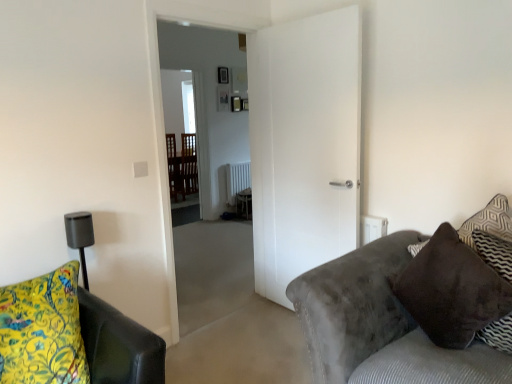
Identify the location of yellow floral fabric cushion at lower left. [x=72, y=336].

Describe the element at coordinates (424, 289) in the screenshot. I see `brown suede pillow at right` at that location.

Where is `white matte door at center`? This screenshot has width=512, height=384. white matte door at center is located at coordinates (304, 145).

Between white matte door at center and transparent glass door at center, which one appears on the right side from the viewer's perspective?

From the viewer's perspective, white matte door at center appears more on the right side.

From the image's perspective, would you say white matte door at center is positioned over transparent glass door at center?

No, from the image's perspective, white matte door at center is not over transparent glass door at center.

Considering the relative sizes of white matte door at center and transparent glass door at center in the image provided, is white matte door at center wider than transparent glass door at center?

Incorrect, the width of white matte door at center does not surpass that of transparent glass door at center.

Which is in front, white matte door at center or transparent glass door at center?

white matte door at center is more forward.

Where is `radiator behind the white matte door at center`? The image size is (512, 384). radiator behind the white matte door at center is located at coordinates (237, 180).

Measure the distance from white matte door at center to white painted radiator at center.

white matte door at center and white painted radiator at center are 14.28 feet apart from each other.

Considering the sizes of objects white matte door at center and white painted radiator at center in the image provided, who is smaller, white matte door at center or white painted radiator at center?

white painted radiator at center is smaller.

Between white painted radiator at center and white matte door at center, which one has larger width?

white painted radiator at center is wider.

Image resolution: width=512 pixels, height=384 pixels. In order to click on door on the right of the white painted radiator at center in this screenshot , I will do `click(304, 145)`.

Considering the positions of objects white painted radiator at center and white matte door at center in the image provided, who is more to the left, white painted radiator at center or white matte door at center?

Positioned to the left is white painted radiator at center.

From the image's perspective, which is below, white painted radiator at center or white matte door at center?

white matte door at center, from the image's perspective.

Can you confirm if white painted radiator at center is taller than brown suede pillow at right?

No, white painted radiator at center is not taller than brown suede pillow at right.

Is white painted radiator at center not close to brown suede pillow at right?

Yes, white painted radiator at center and brown suede pillow at right are quite far apart.

From the image's perspective, would you say white painted radiator at center is positioned over brown suede pillow at right?

Correct, white painted radiator at center appears higher than brown suede pillow at right in the image.

Which is in front, point (234, 193) or point (437, 250)?

Point (437, 250)

From the image's perspective, is yellow floral fabric cushion at lower left positioned above or below transparent glass door at center?

yellow floral fabric cushion at lower left is below transparent glass door at center.

Is yellow floral fabric cushion at lower left facing away from transparent glass door at center?

yellow floral fabric cushion at lower left is not turned away from transparent glass door at center.

From a real-world perspective, is yellow floral fabric cushion at lower left physically located above or below transparent glass door at center?

yellow floral fabric cushion at lower left is situated lower than transparent glass door at center in the real world.

Which is in front, white painted radiator at center or yellow floral fabric cushion at lower left?

yellow floral fabric cushion at lower left is closer to the camera.

From a real-world perspective, is white painted radiator at center positioned above or below yellow floral fabric cushion at lower left?

white painted radiator at center is situated lower than yellow floral fabric cushion at lower left in the real world.

Considering the relative positions of white painted radiator at center and yellow floral fabric cushion at lower left in the image provided, is white painted radiator at center to the right of yellow floral fabric cushion at lower left from the viewer's perspective?

Correct, you'll find white painted radiator at center to the right of yellow floral fabric cushion at lower left.

Is white painted radiator at center with yellow floral fabric cushion at lower left?

There is a gap between white painted radiator at center and yellow floral fabric cushion at lower left.

Do you think brown suede pillow at right is within white painted radiator at center, or outside of it?

brown suede pillow at right is spatially situated outside white painted radiator at center.

Is brown suede pillow at right positioned with its back to white painted radiator at center?

brown suede pillow at right does not have its back to white painted radiator at center.

Who is bigger, brown suede pillow at right or white painted radiator at center?

brown suede pillow at right is bigger.

Is brown suede pillow at right directly adjacent to white painted radiator at center?

brown suede pillow at right is not next to white painted radiator at center, and they're not touching.

At what (x,y) coordinates should I click in order to perform the action: click on door beneath the transparent glass door at center (from a real-world perspective). Please return your answer as a coordinate pair (x, y). The height and width of the screenshot is (384, 512). Looking at the image, I should click on (304, 145).

Locate an element on the screen. door that appears in front of the white painted radiator at center is located at coordinates (304, 145).

When comparing their distances from yellow floral fabric cushion at lower left, does white matte door at center or transparent glass door at center seem closer?

Based on the image, white matte door at center appears to be nearer to yellow floral fabric cushion at lower left.

Based on the photo, estimate the real-world distances between objects in this image. Which object is closer to brown suede pillow at right, transparent glass door at center or velvet gray couch at right?

Among the two, velvet gray couch at right is located nearer to brown suede pillow at right.

Based on their spatial positions, is white matte door at center or velvet gray couch at right further from white painted radiator at center?

velvet gray couch at right lies further to white painted radiator at center than the other object.

Based on their spatial positions, is yellow floral fabric cushion at lower left or brown suede pillow at right further from velvet gray couch at right?

Among the two, yellow floral fabric cushion at lower left is located further to velvet gray couch at right.

Looking at the image, which one is located closer to brown suede pillow at right, transparent glass door at center or white painted radiator at center?

white painted radiator at center lies closer to brown suede pillow at right than the other object.

When comparing their distances from yellow floral fabric cushion at lower left, does transparent glass door at center or white painted radiator at center seem closer?

white painted radiator at center.

Which object lies further to the anchor point brown suede pillow at right, white painted radiator at center or velvet gray couch at right?

Among the two, white painted radiator at center is located further to brown suede pillow at right.

Based on their spatial positions, is white painted radiator at center or velvet gray couch at right closer to transparent glass door at center?

white painted radiator at center lies closer to transparent glass door at center than the other object.

This screenshot has height=384, width=512. Find the location of `door between velvet gray couch at right and transparent glass door at center in the front-back direction`. door between velvet gray couch at right and transparent glass door at center in the front-back direction is located at coordinates (304, 145).

Locate an element on the screen. The width and height of the screenshot is (512, 384). glass door between velvet gray couch at right and white painted radiator at center along the z-axis is located at coordinates [x=188, y=119].

Locate an element on the screen. door located between yellow floral fabric cushion at lower left and velvet gray couch at right in the left-right direction is located at coordinates (304, 145).

Identify the location of pillow between velvet gray couch at right and white matte door at center from front to back. Image resolution: width=512 pixels, height=384 pixels. (424, 289).